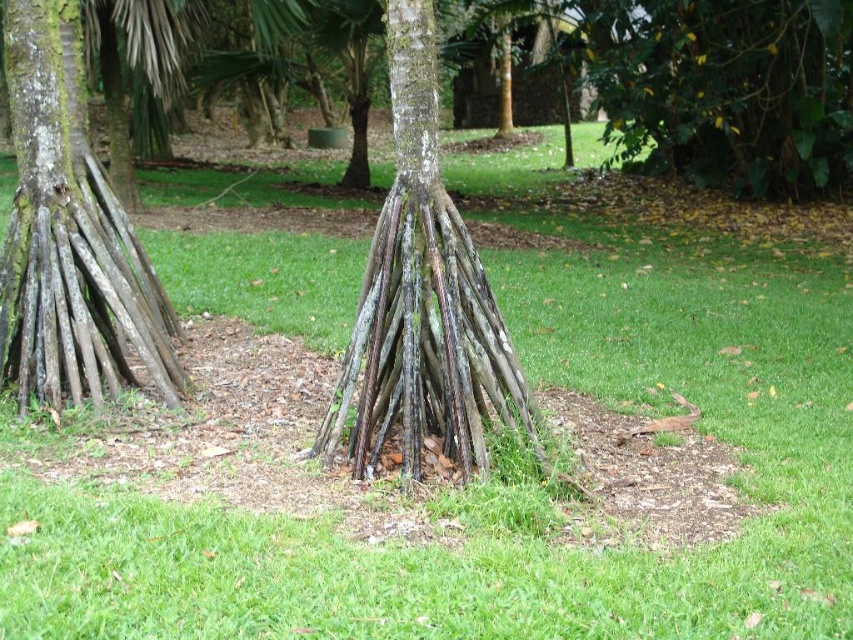
You are a gardener assessing the structures in the garden. You need to determine which structure is taller between the smooth brown wood at left and the brown rough textured roots at center. Which one is taller?

The smooth brown wood at left is taller than the brown rough textured roots at center.

You are a gardener who needs to place a 2.0 meter long wooden plank between the smooth brown wood at left and the brown rough textured roots at center. Can the plank fit between them without bending?

The distance between the smooth brown wood at left and the brown rough textured roots at center is 2.01 meters. Since the plank is 2.0 meters long, it can fit between them without bending as there is a slight extra space available.